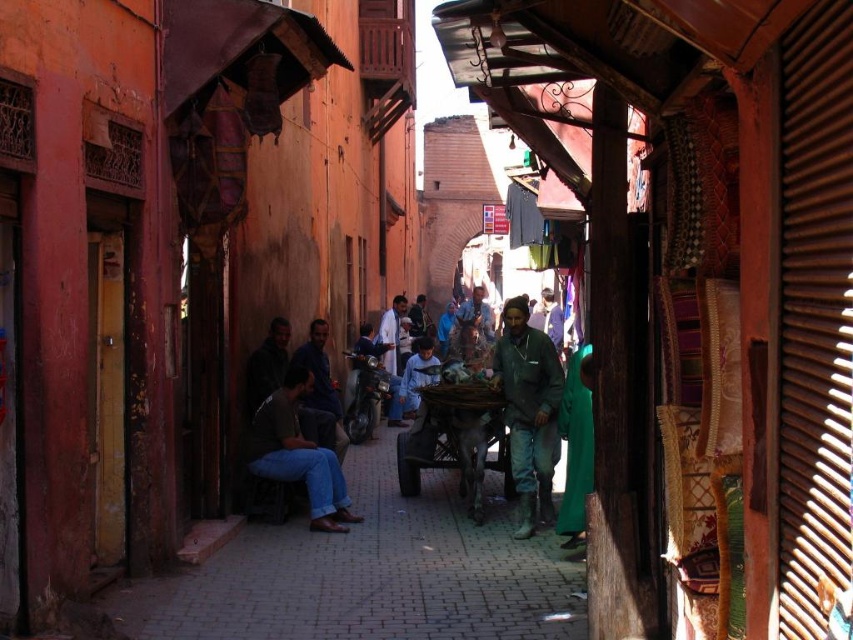
You are standing in the middle of the street and want to walk towards the two points marked in the scene. Which point, point (x=531, y=486) or point (x=316, y=364), will you reach first?

Point (x=531, y=486) is closer to the viewer than point (x=316, y=364), so you will reach point (x=531, y=486) first.

You are a photographer standing at the entrance of the alleyway. You want to take a photo that includes both the green matte jacket at center and the white clothed man at center. Which object should you focus on first to ensure both are in frame?

The green matte jacket at center is taller than the white clothed man at center. To ensure both are in frame, focus on the taller object first, which is the green matte jacket at center, then adjust the camera angle to include the white clothed man at center.

You are a traveler standing in the middle of the alleyway and see both the green matte jacket at center and the dark brown leather jacket at center. Which jacket is located to your right?

The green matte jacket at center is positioned on the right side of dark brown leather jacket at center, so the green matte jacket at center is to your right.